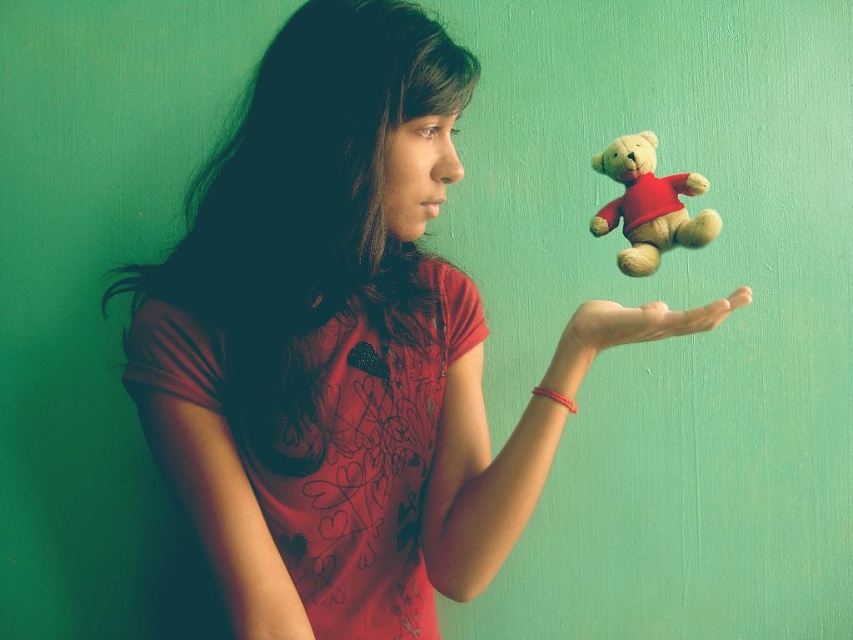
Question: Which point is closer to the camera taking this photo?

Choices:
 (A) (643, 272)
 (B) (587, 346)

Answer: (B)

Question: Can you confirm if velvet beige teddy bear at center is wider than matte skin hand at center?

Choices:
 (A) yes
 (B) no

Answer: (B)

Question: Can you confirm if velvet beige teddy bear at center is positioned to the right of matte skin hand at center?

Choices:
 (A) no
 (B) yes

Answer: (B)

Question: Does velvet beige teddy bear at center lie in front of matte skin hand at center?

Choices:
 (A) no
 (B) yes

Answer: (A)

Question: Which point is closer to the camera taking this photo?

Choices:
 (A) (720, 317)
 (B) (640, 134)

Answer: (A)